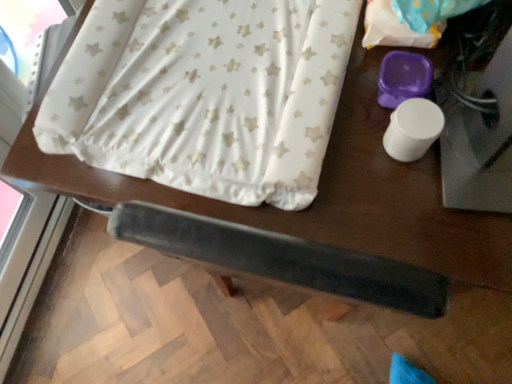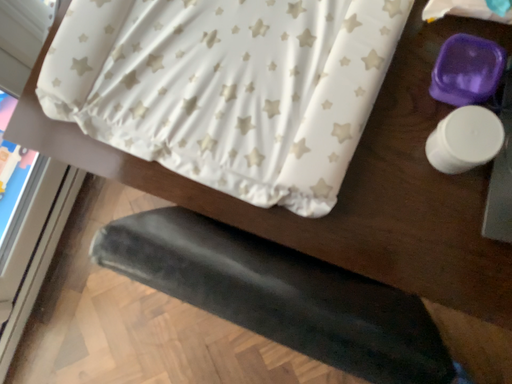
Question: How did the camera likely rotate when shooting the video?

Choices:
 (A) rotated downward
 (B) rotated upward

Answer: (A)